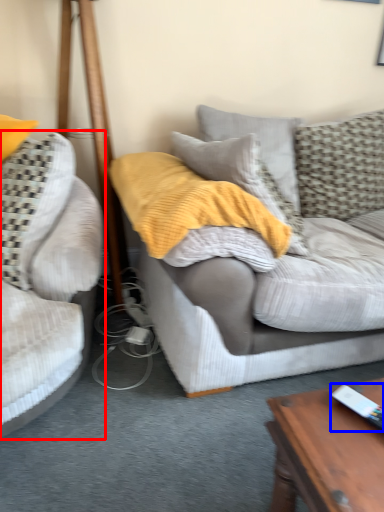
Question: Which object appears closest to the camera in this image, studio couch (highlighted by a red box) or ipod (highlighted by a blue box)?

Choices:
 (A) studio couch
 (B) ipod

Answer: (B)